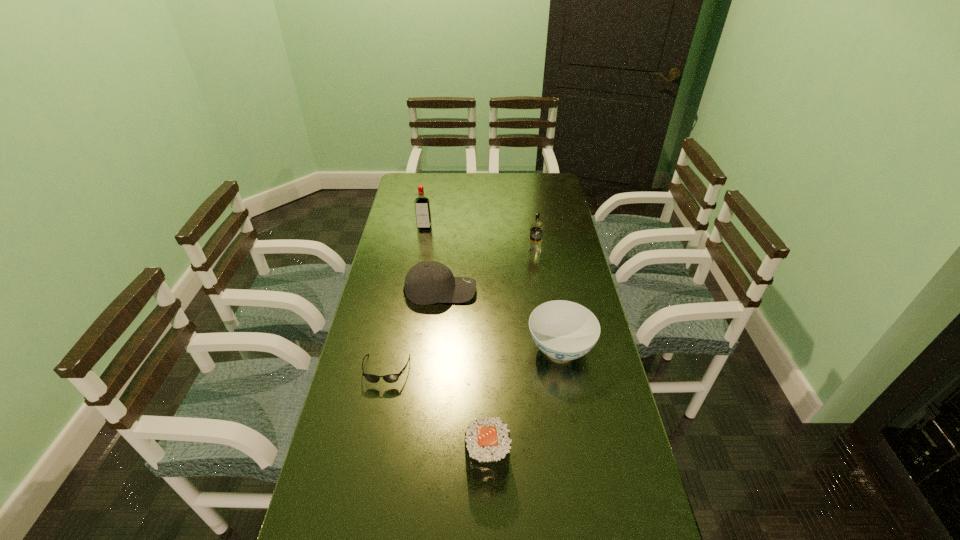
I want to click on the farther vodka, so click(x=422, y=204).

Identify the location of the farthest object. (422, 204).

In order to click on the right vodka in this screenshot , I will do `click(536, 227)`.

Locate an element on the screen. This screenshot has height=540, width=960. the nearer vodka is located at coordinates (536, 227).

At what (x,y) coordinates should I click in order to perform the action: click on baseball cap. Please return your answer as a coordinate pair (x, y). Looking at the image, I should click on (427, 282).

Image resolution: width=960 pixels, height=540 pixels. I want to click on sushi, so click(487, 441).

Where is `chinaware`? The width and height of the screenshot is (960, 540). chinaware is located at coordinates (564, 330).

I want to click on sunglasses, so click(x=391, y=378).

You are a GUI agent. You are given a task and a screenshot of the screen. Output one action in this format:
    pyautogui.click(x=<x>, y=<y>)
    Task: Click on the vacant area located on the front and back of the left vodka
    
    Given the screenshot: What is the action you would take?
    pyautogui.click(x=420, y=252)

Find the location of `vacant space located on the label of the nearer vodka`. vacant space located on the label of the nearer vodka is located at coordinates (542, 308).